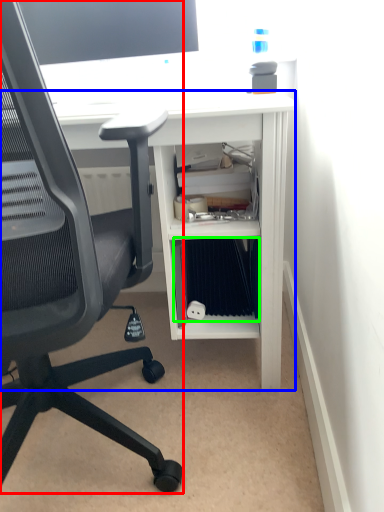
Question: Based on their relative distances, which object is farther from chair (highlighted by a red box)? Choose from desk (highlighted by a blue box) and binder (highlighted by a green box).

Choices:
 (A) desk
 (B) binder

Answer: (B)